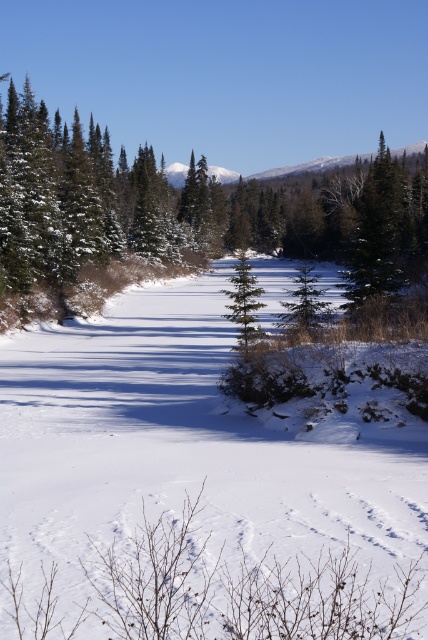
From the picture: Which is more to the left, green matte evergreen tree at center or green matte tree at center?

Positioned to the left is green matte tree at center.

Is point (113, 262) closer to viewer compared to point (243, 252)?

Yes, it is.

Find the location of a particular element. This screenshot has width=428, height=640. green matte evergreen tree at center is located at coordinates [187, 216].

Which is in front, point (155, 390) or point (246, 275)?

Positioned in front is point (155, 390).

Does white fluffy snow at center lie in front of green matte tree at center?

Yes, white fluffy snow at center is in front of green matte tree at center.

At what (x,y) coordinates should I click in order to perform the action: click on white fluffy snow at center. Please return your answer as a coordinate pair (x, y). Image resolution: width=428 pixels, height=640 pixels. Looking at the image, I should click on (184, 445).

Where is `white fluffy snow at center`? This screenshot has width=428, height=640. white fluffy snow at center is located at coordinates (184, 445).

Is white fluffy snow at center above green matte evergreen tree at center?

Incorrect, white fluffy snow at center is not positioned above green matte evergreen tree at center.

Between point (5, 460) and point (148, 211), which one is positioned in front?

Point (5, 460)

Does point (51, 420) lie in front of point (369, 154)?

Yes, it is in front of point (369, 154).

Identify the location of white fluffy snow at center. The width and height of the screenshot is (428, 640). (184, 445).